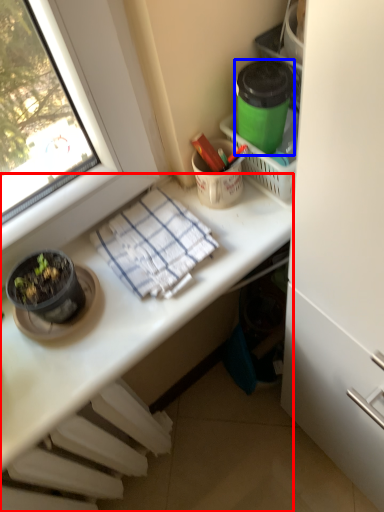
Question: Which of the following is the farthest to the observer, desk (highlighted by a red box) or appliance (highlighted by a blue box)?

Choices:
 (A) desk
 (B) appliance

Answer: (B)